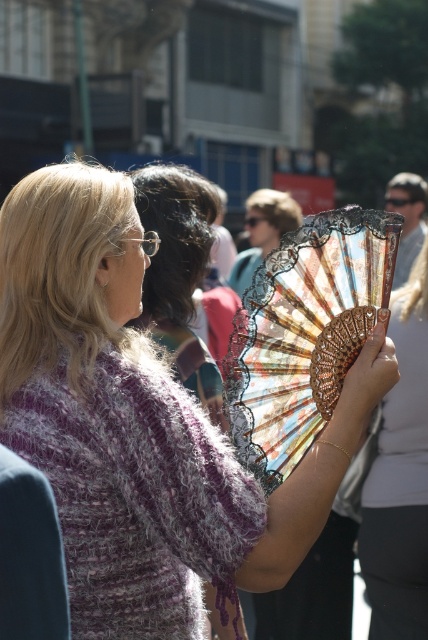
Question: Can you confirm if knitted purple sweater at center is smaller than wooden fan at center?

Choices:
 (A) yes
 (B) no

Answer: (B)

Question: Can you confirm if knitted purple sweater at center is positioned above wooden fan at center?

Choices:
 (A) yes
 (B) no

Answer: (A)

Question: Which object appears farthest from the camera in this image?

Choices:
 (A) wooden fan at center
 (B) knitted purple sweater at center

Answer: (A)

Question: Does knitted purple sweater at center have a greater width compared to wooden fan at center?

Choices:
 (A) no
 (B) yes

Answer: (B)

Question: Among these points, which one is farthest from the camera?

Choices:
 (A) tap(391, 324)
 (B) tap(252, 545)
 (C) tap(380, 344)

Answer: (A)

Question: Among these points, which one is farthest from the camera?

Choices:
 (A) (38, 200)
 (B) (329, 422)
 (C) (413, 388)

Answer: (C)